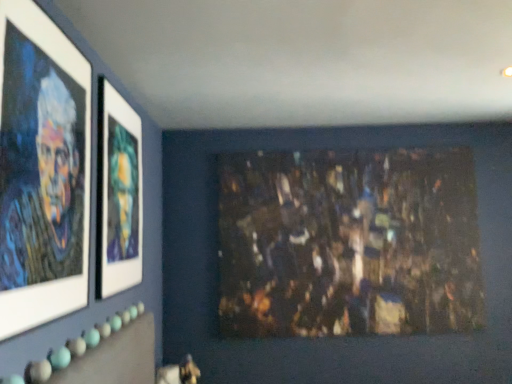
Where is `matte black portrait at left, which is counted as the 2th picture frame, starting from the back`? matte black portrait at left, which is counted as the 2th picture frame, starting from the back is located at coordinates (42, 170).

Which object is positioned more to the right, dark textured painting at center or matte black portrait at left, arranged as the 1th picture frame when viewed from the front?

dark textured painting at center.

From a real-world perspective, is dark textured painting at center located higher than matte black portrait at left, arranged as the 1th picture frame when viewed from the front?

No, from a real-world perspective, dark textured painting at center is not on top of matte black portrait at left, arranged as the 1th picture frame when viewed from the front.

Is dark textured painting at center looking in the opposite direction of matte black portrait at left, which is counted as the 2th picture frame, starting from the back?

No, dark textured painting at center is not facing the opposite direction of matte black portrait at left, which is counted as the 2th picture frame, starting from the back.

In the image, is dark textured painting at center positioned in front of or behind matte black portrait at left, which is counted as the 2th picture frame, starting from the back?

Clearly, dark textured painting at center is behind matte black portrait at left, which is counted as the 2th picture frame, starting from the back.

Considering the sizes of objects matte glass picture frame at upper left, the first picture frame viewed from the back, and matte black portrait at left, arranged as the 1th picture frame when viewed from the front, in the image provided, who is taller, matte glass picture frame at upper left, the first picture frame viewed from the back, or matte black portrait at left, arranged as the 1th picture frame when viewed from the front,?

matte glass picture frame at upper left, the first picture frame viewed from the back.

Considering the positions of points (127, 157) and (71, 90), is point (127, 157) farther from camera compared to point (71, 90)?

That is True.

From the picture: From the image's perspective, between matte glass picture frame at upper left, the first picture frame viewed from the back, and matte black portrait at left, arranged as the 1th picture frame when viewed from the front, who is located below?

From the image's view, matte glass picture frame at upper left, the first picture frame viewed from the back, is below.

Is matte glass picture frame at upper left, the first picture frame viewed from the back, positioned in front of matte black portrait at left, which is counted as the 2th picture frame, starting from the back?

No.

Is matte black portrait at left, which is counted as the 2th picture frame, starting from the back, closer to the viewer compared to matte glass picture frame at upper left, the first picture frame viewed from the back?

Yes.

Which of these two, matte black portrait at left, which is counted as the 2th picture frame, starting from the back, or matte glass picture frame at upper left, the second picture frame viewed from the front, is wider?

matte glass picture frame at upper left, the second picture frame viewed from the front.

Is point (20, 45) behind point (141, 154)?

No, (20, 45) is in front of (141, 154).

Consider the image. Considering the relative sizes of matte glass picture frame at upper left, the second picture frame viewed from the front, and dark textured painting at center in the image provided, is matte glass picture frame at upper left, the second picture frame viewed from the front, wider than dark textured painting at center?

Incorrect, the width of matte glass picture frame at upper left, the second picture frame viewed from the front, does not surpass that of dark textured painting at center.

From the picture: Considering the positions of objects matte glass picture frame at upper left, the first picture frame viewed from the back, and dark textured painting at center in the image provided, who is more to the left, matte glass picture frame at upper left, the first picture frame viewed from the back, or dark textured painting at center?

matte glass picture frame at upper left, the first picture frame viewed from the back.

This screenshot has width=512, height=384. What are the coordinates of `art located behind the matte glass picture frame at upper left, the second picture frame viewed from the front` in the screenshot? It's located at (349, 243).

Which of these two, dark textured painting at center or matte glass picture frame at upper left, the first picture frame viewed from the back, is wider?

Wider between the two is dark textured painting at center.

Looking at this image, could matte glass picture frame at upper left, the first picture frame viewed from the back, be considered to be inside dark textured painting at center?

That's incorrect, matte glass picture frame at upper left, the first picture frame viewed from the back, is not inside dark textured painting at center.

Is dark textured painting at center turned away from matte glass picture frame at upper left, the second picture frame viewed from the front?

No, dark textured painting at center's orientation is not away from matte glass picture frame at upper left, the second picture frame viewed from the front.

Would you say dark textured painting at center is to the left or to the right of matte glass picture frame at upper left, the second picture frame viewed from the front, in the picture?

Based on their positions, dark textured painting at center is located to the right of matte glass picture frame at upper left, the second picture frame viewed from the front.

Which point is more distant from viewer, (59, 141) or (470, 267)?

The point (470, 267) is behind.

Is matte black portrait at left, arranged as the 1th picture frame when viewed from the front, to the left or to the right of dark textured painting at center in the image?

matte black portrait at left, arranged as the 1th picture frame when viewed from the front, is positioned on dark textured painting at center's left side.

Is matte black portrait at left, arranged as the 1th picture frame when viewed from the front, oriented away from dark textured painting at center?

That's not correct — matte black portrait at left, arranged as the 1th picture frame when viewed from the front, is not looking away from dark textured painting at center.

From the image's perspective, count 2nd picture frames upward from the dark textured painting at center and point to it. Please provide its 2D coordinates.

[(42, 170)]

Where is `picture frame positioned vertically above the matte black portrait at left, arranged as the 1th picture frame when viewed from the front (from a real-world perspective)`? picture frame positioned vertically above the matte black portrait at left, arranged as the 1th picture frame when viewed from the front (from a real-world perspective) is located at coordinates (118, 194).

From the image, which object appears to be nearer to dark textured painting at center, matte glass picture frame at upper left, the second picture frame viewed from the front, or matte black portrait at left, which is counted as the 2th picture frame, starting from the back?

matte glass picture frame at upper left, the second picture frame viewed from the front, is closer to dark textured painting at center.

Which object lies further to the anchor point matte glass picture frame at upper left, the first picture frame viewed from the back, matte black portrait at left, arranged as the 1th picture frame when viewed from the front, or dark textured painting at center?

Based on the image, dark textured painting at center appears to be further to matte glass picture frame at upper left, the first picture frame viewed from the back.

Based on their spatial positions, is matte black portrait at left, arranged as the 1th picture frame when viewed from the front, or matte glass picture frame at upper left, the first picture frame viewed from the back, further from dark textured painting at center?

The object further to dark textured painting at center is matte black portrait at left, arranged as the 1th picture frame when viewed from the front.

When comparing their distances from matte black portrait at left, which is counted as the 2th picture frame, starting from the back, does dark textured painting at center or matte glass picture frame at upper left, the first picture frame viewed from the back, seem closer?

matte glass picture frame at upper left, the first picture frame viewed from the back.

Based on their spatial positions, is matte glass picture frame at upper left, the second picture frame viewed from the front, or dark textured painting at center further from matte black portrait at left, which is counted as the 2th picture frame, starting from the back?

dark textured painting at center.

Looking at the image, which one is located further to matte glass picture frame at upper left, the first picture frame viewed from the back, dark textured painting at center or matte black portrait at left, which is counted as the 2th picture frame, starting from the back?

Based on the image, dark textured painting at center appears to be further to matte glass picture frame at upper left, the first picture frame viewed from the back.

The image size is (512, 384). In order to click on picture frame between matte black portrait at left, which is counted as the 2th picture frame, starting from the back, and dark textured painting at center from front to back in this screenshot , I will do `click(118, 194)`.